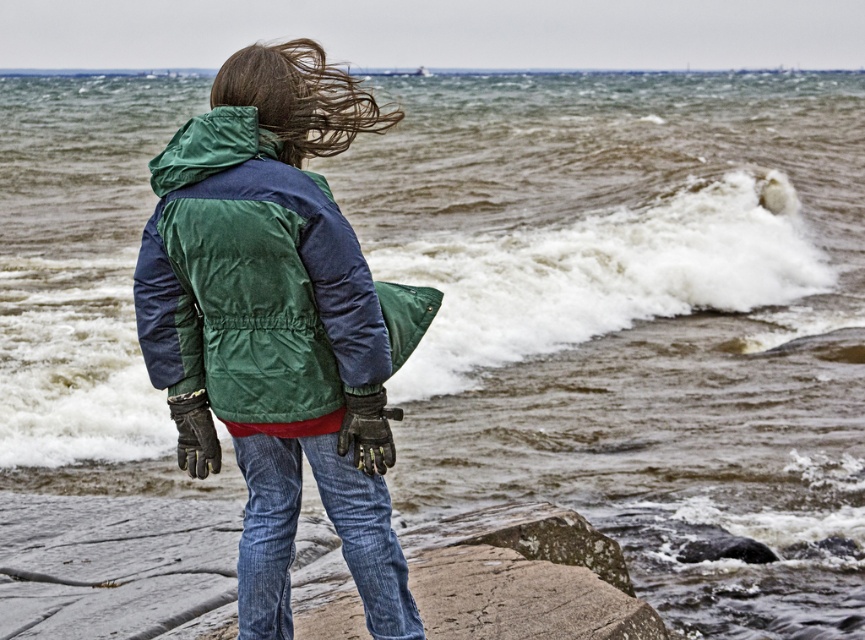
You are a photographer trying to capture the person in the green quilted jacket at center. The camera you are using has a limited field of view. Given that the point representing the jacket is at coordinates point (261, 285), where should you position the camera to ensure the jacket is centered in the frame?

The green quilted jacket at center is represented by point (261, 285), so positioning the camera so that this point is at the center of the frame will ensure the jacket is centered.

From the picture: You are a photographer standing 5 meters away from the green quilted jacket at center. You want to take a clear photo of it without moving closer. Is the distance sufficient for a clear shot?

The distance between you and the green quilted jacket at center is 5.73 meters. Since you are 5 meters away, you are closer than the actual distance, so the distance is sufficient for a clear photo without moving closer.